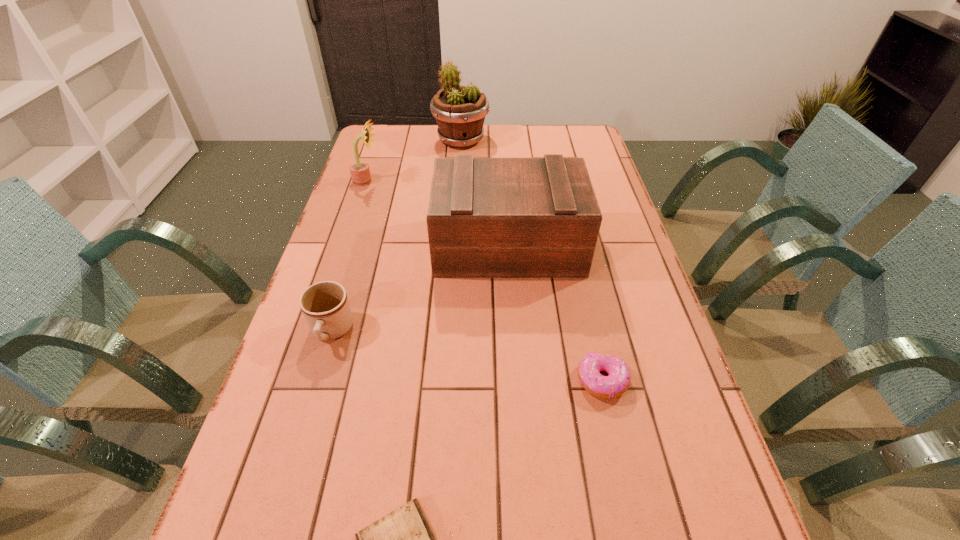
This screenshot has width=960, height=540. I want to click on free space located 0.210m on the face of the fifth nearest object, so click(x=442, y=181).

The height and width of the screenshot is (540, 960). Identify the location of vacant space located on the side of the fourth tallest object with the handle. (289, 472).

This screenshot has height=540, width=960. Find the location of `free spot located 0.190m on the back of the second shortest object`. free spot located 0.190m on the back of the second shortest object is located at coordinates (584, 297).

The width and height of the screenshot is (960, 540). What are the coordinates of `object that is at the far edge` in the screenshot? It's located at [460, 111].

Find the location of a particular element. This screenshot has height=540, width=960. sunflower located in the left edge section of the desktop is located at coordinates (360, 173).

The height and width of the screenshot is (540, 960). In order to click on mug that is at the left edge in this screenshot , I will do `click(325, 306)`.

In order to click on box positioned at the right edge in this screenshot , I will do `click(487, 217)`.

At what (x,y) coordinates should I click in order to perform the action: click on doughnut present at the right edge. Please return your answer as a coordinate pair (x, y). Looking at the image, I should click on (617, 382).

Where is `free space at the far edge of the desktop`? free space at the far edge of the desktop is located at coordinates (485, 137).

Image resolution: width=960 pixels, height=540 pixels. I want to click on free space at the left edge of the desktop, so click(262, 432).